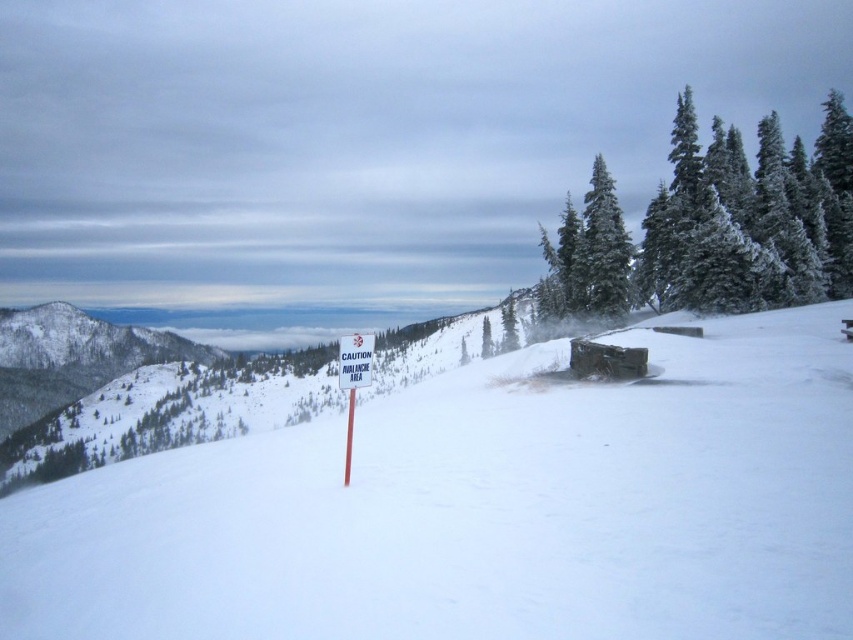
Question: Which point is closer to the camera?

Choices:
 (A) snow-covered evergreen at upper right
 (B) white snow at center

Answer: (B)

Question: Can you confirm if white snow at center is smaller than white plastic sign at center?

Choices:
 (A) no
 (B) yes

Answer: (A)

Question: Considering the real-world distances, which object is closest to the white plastic sign at center?

Choices:
 (A) snow-covered evergreen at upper right
 (B) white snow at center

Answer: (B)

Question: Does white snow at center come in front of white plastic sign at center?

Choices:
 (A) no
 (B) yes

Answer: (B)

Question: Does white snow at center have a greater width compared to snow-covered evergreen at upper right?

Choices:
 (A) yes
 (B) no

Answer: (B)

Question: Which object is positioned closest to the white snow at center?

Choices:
 (A) snow-covered evergreen at upper right
 (B) white plastic sign at center

Answer: (B)